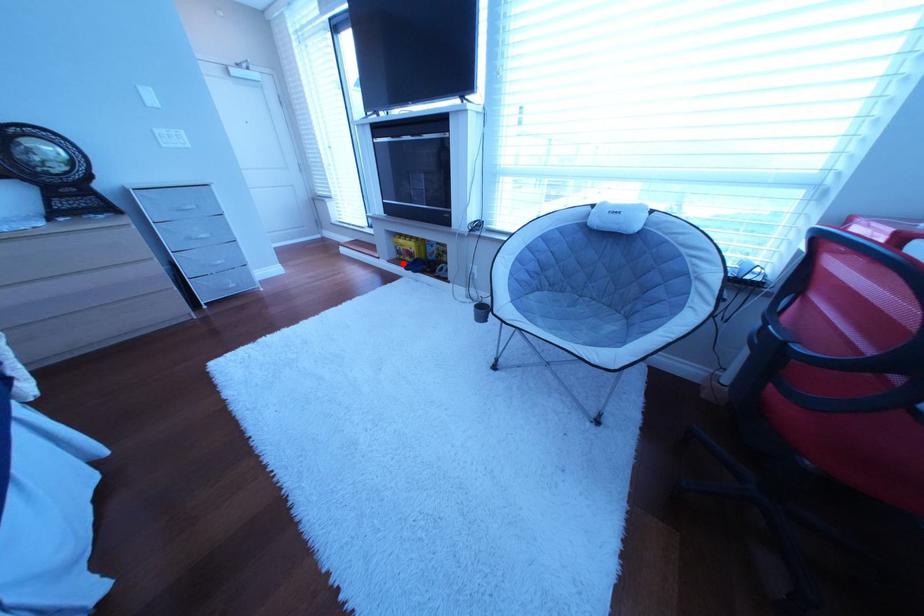
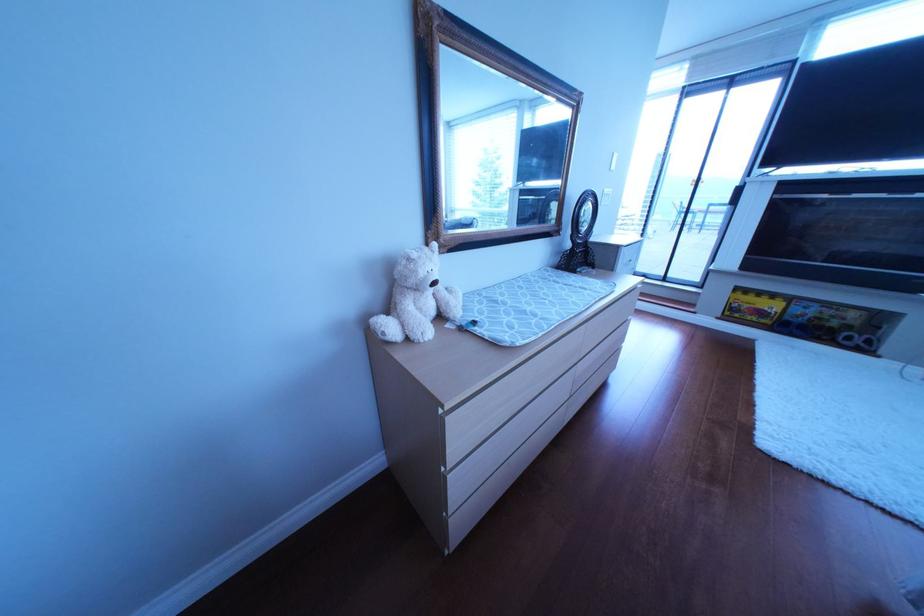
Question: I am providing you with two images of the same scene from different viewpoints. Image1 has a red point marked. In image2, the corresponding 3D location appears at what relative position? Reply with the corresponding letter.

Choices:
 (A) Closer
 (B) Farther

Answer: (A)